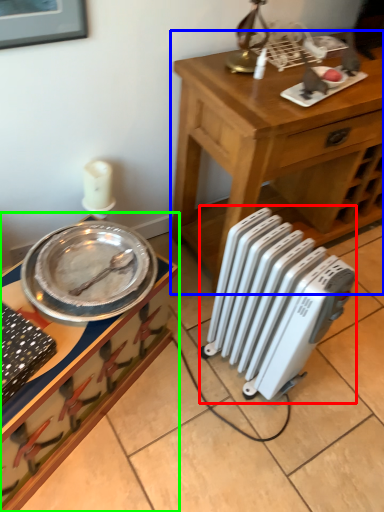
Question: Which is nearer to the radiator (highlighted by a red box)? table (highlighted by a blue box) or desk (highlighted by a green box).

Choices:
 (A) table
 (B) desk

Answer: (B)